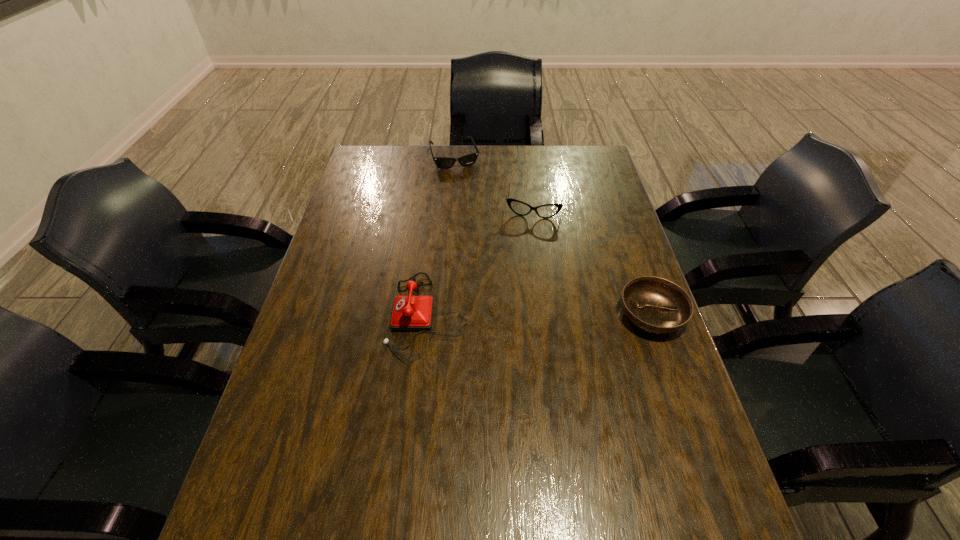
Image resolution: width=960 pixels, height=540 pixels. I want to click on vacant space located 0.130m on the front-facing side of the third object from left to right, so click(x=526, y=247).

At what (x,y) coordinates should I click in order to perform the action: click on vacant region located 0.390m on the front-facing side of the third object from left to right. Please return your answer as a coordinate pair (x, y). Looking at the image, I should click on (515, 313).

This screenshot has width=960, height=540. Find the location of `vacant space located on the front-facing side of the farthest object`. vacant space located on the front-facing side of the farthest object is located at coordinates [474, 210].

At what (x,y) coordinates should I click in order to perform the action: click on free space located 0.190m on the front-facing side of the farthest object. Please return your answer as a coordinate pair (x, y). Looking at the image, I should click on (470, 201).

Locate an element on the screen. The image size is (960, 540). vacant space situated on the front-facing side of the farthest object is located at coordinates (470, 201).

Identify the location of object that is at the far edge. The height and width of the screenshot is (540, 960). (467, 160).

I want to click on object located at the right edge, so click(653, 304).

Where is `vacant space at the far edge`? Image resolution: width=960 pixels, height=540 pixels. vacant space at the far edge is located at coordinates (498, 166).

Where is `free space at the left edge of the desktop`? free space at the left edge of the desktop is located at coordinates (309, 339).

Locate an element on the screen. The image size is (960, 540). free space at the right edge of the desktop is located at coordinates (599, 225).